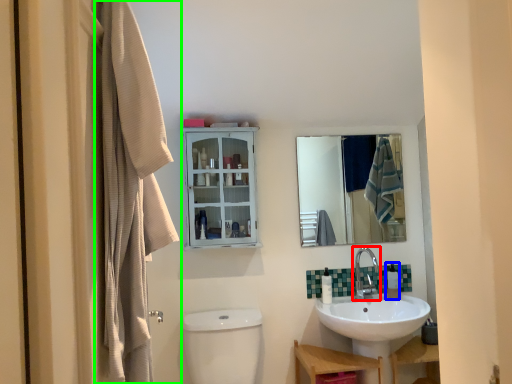
Question: Which object is the closest to the tap (highlighted by a red box)? Choose among these: toiletry (highlighted by a blue box) or curtain (highlighted by a green box).

Choices:
 (A) toiletry
 (B) curtain

Answer: (A)